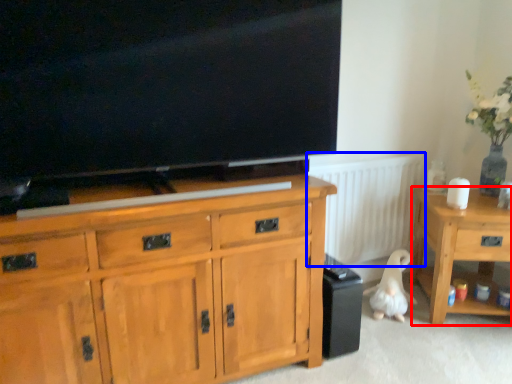
Question: Among these objects, which one is farthest to the camera, desk (highlighted by a red box) or radiator (highlighted by a blue box)?

Choices:
 (A) desk
 (B) radiator

Answer: (B)